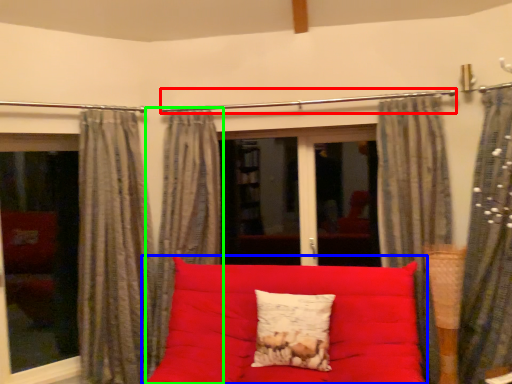
Question: Which is farther away from clothesline (highlighted by a red box)? studio couch (highlighted by a blue box) or curtain (highlighted by a green box)?

Choices:
 (A) studio couch
 (B) curtain

Answer: (A)